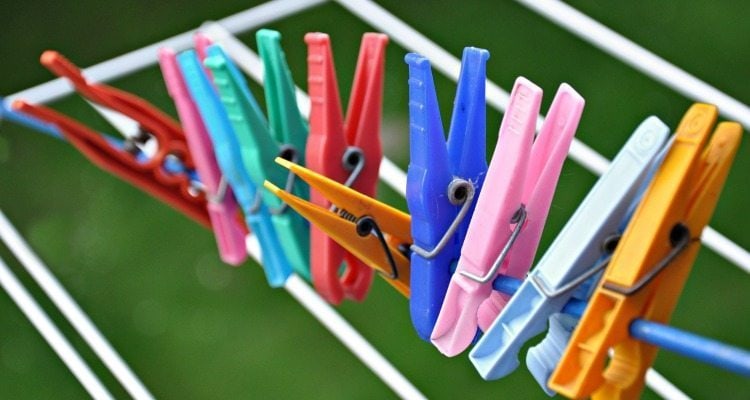
Locate an element on the screen. Image resolution: width=750 pixels, height=400 pixels. 1 blue cord is located at coordinates (708, 350).